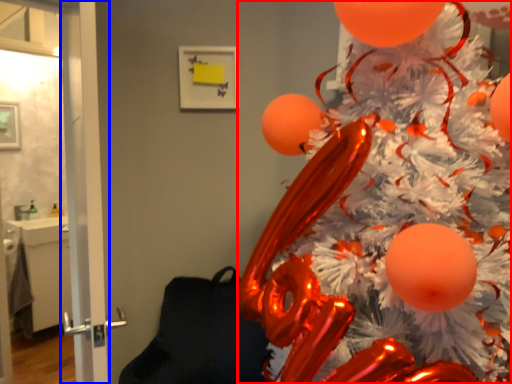
Question: Which of the following is the farthest to the observer, christmas tree (highlighted by a red box) or screen door (highlighted by a blue box)?

Choices:
 (A) christmas tree
 (B) screen door

Answer: (B)